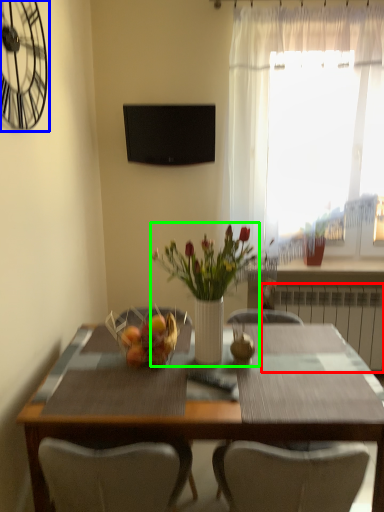
Question: Based on their relative distances, which object is nearer to radiator (highlighted by a red box)? Choose from clock (highlighted by a blue box) and floral arrangement (highlighted by a green box).

Choices:
 (A) clock
 (B) floral arrangement

Answer: (B)